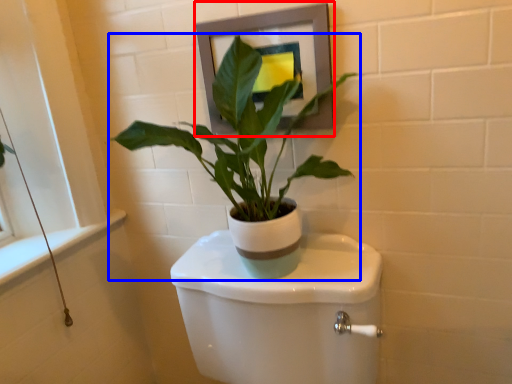
Question: Among these objects, which one is farthest to the camera, picture frame (highlighted by a red box) or houseplant (highlighted by a blue box)?

Choices:
 (A) picture frame
 (B) houseplant

Answer: (A)